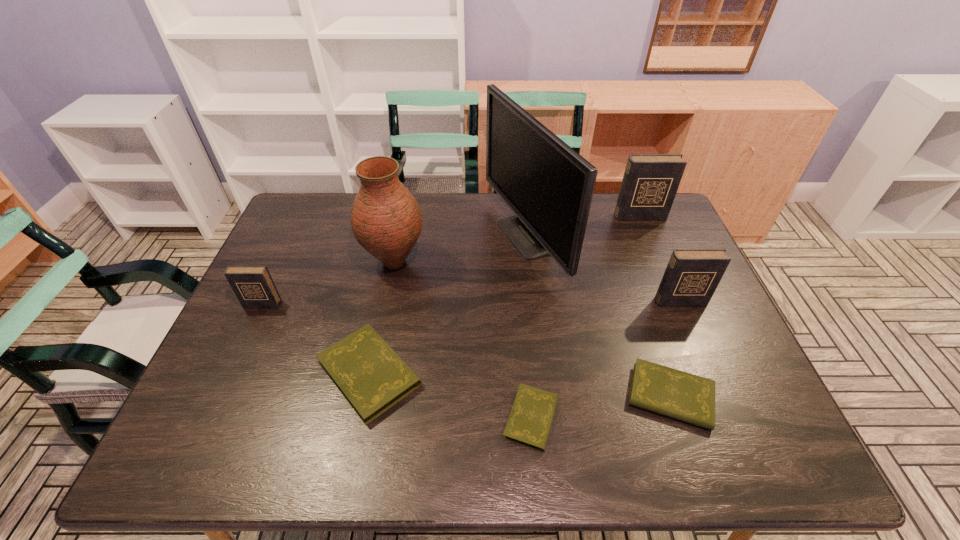
Locate an element on the screen. This screenshot has height=540, width=960. free space located 0.160m on the front cover of the leftmost object is located at coordinates (237, 356).

Where is `vacant space situated on the back of the biggest green diary`? vacant space situated on the back of the biggest green diary is located at coordinates (396, 239).

Where is `blank space located on the back of the second biggest green diary`? blank space located on the back of the second biggest green diary is located at coordinates (640, 306).

What are the coordinates of `free space located on the back of the third diary from left to right` in the screenshot? It's located at (527, 369).

This screenshot has width=960, height=540. Find the location of `computer monitor present at the far edge`. computer monitor present at the far edge is located at coordinates (549, 186).

Identify the location of diary positioned at the far edge. Image resolution: width=960 pixels, height=540 pixels. (650, 182).

Image resolution: width=960 pixels, height=540 pixels. I want to click on object located at the left edge, so click(x=253, y=285).

Where is `object that is at the far right corner`? object that is at the far right corner is located at coordinates (650, 182).

At what (x,y) coordinates should I click in order to perform the action: click on object present at the near right corner. Please return your answer as a coordinate pair (x, y). The height and width of the screenshot is (540, 960). Looking at the image, I should click on (690, 398).

Locate an element on the screen. The height and width of the screenshot is (540, 960). vacant space at the far edge of the desktop is located at coordinates (330, 233).